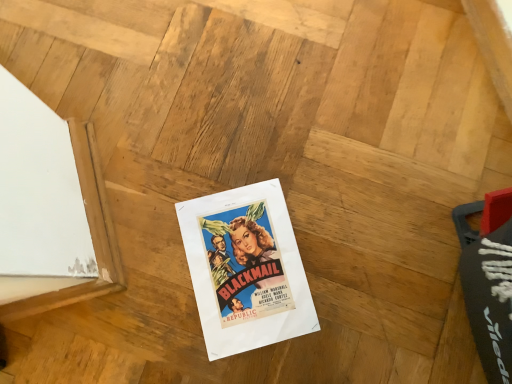
The image size is (512, 384). What are the coordinates of `vacant space in front of matte paper poster at center` in the screenshot? It's located at point(217,358).